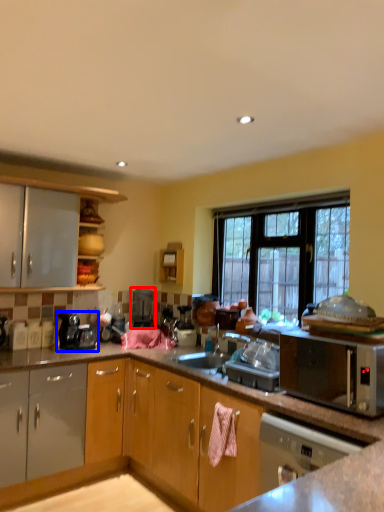
Question: Which of the following is the closest to the observer, appliance (highlighted by a red box) or coffee machine (highlighted by a blue box)?

Choices:
 (A) appliance
 (B) coffee machine

Answer: (B)